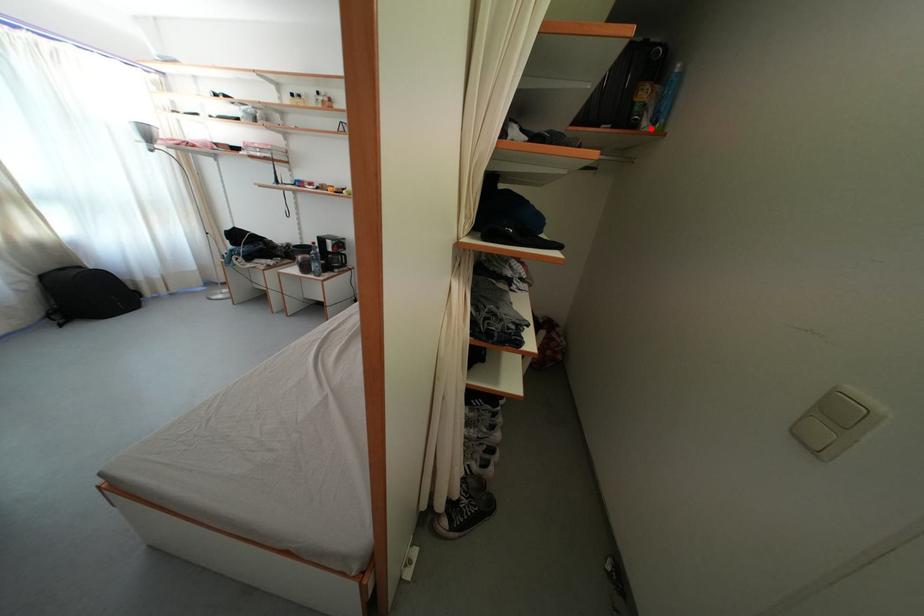
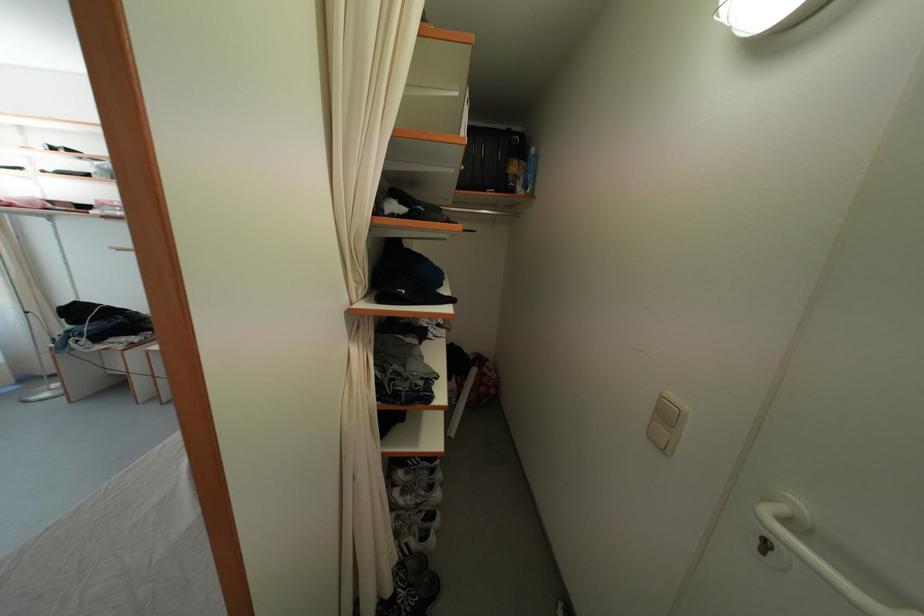
The point at the highlighted location is marked in the first image. Where is the corresponding point in the second image?

(525, 195)